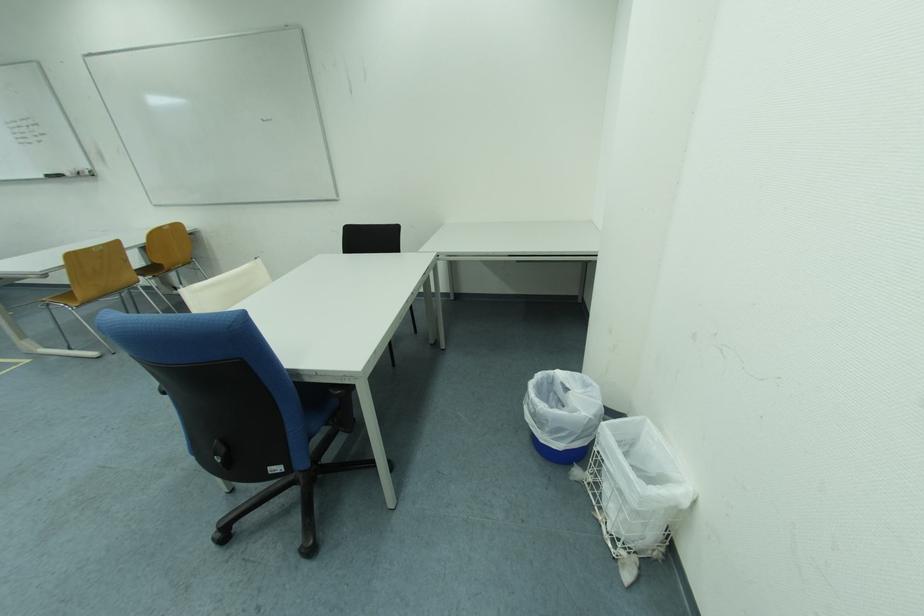
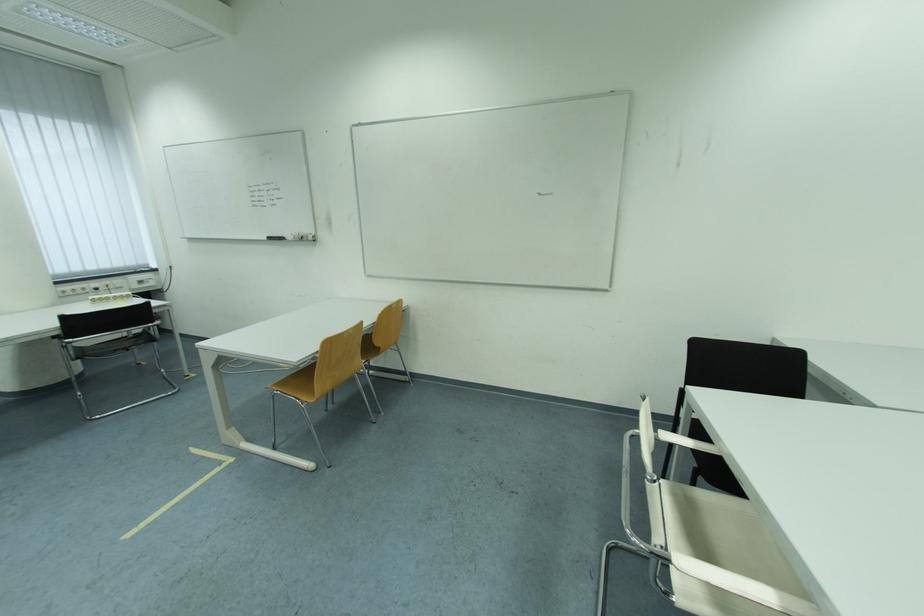
Question: In a continuous first-person perspective shot, in which direction is the camera moving?

Choices:
 (A) Left
 (B) Right
 (C) Forward
 (D) Backward

Answer: (A)